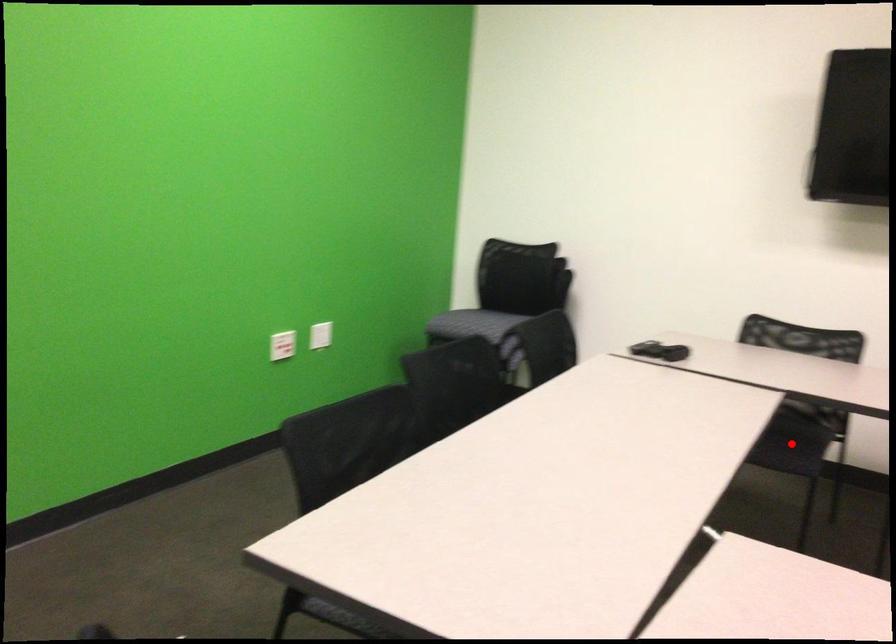
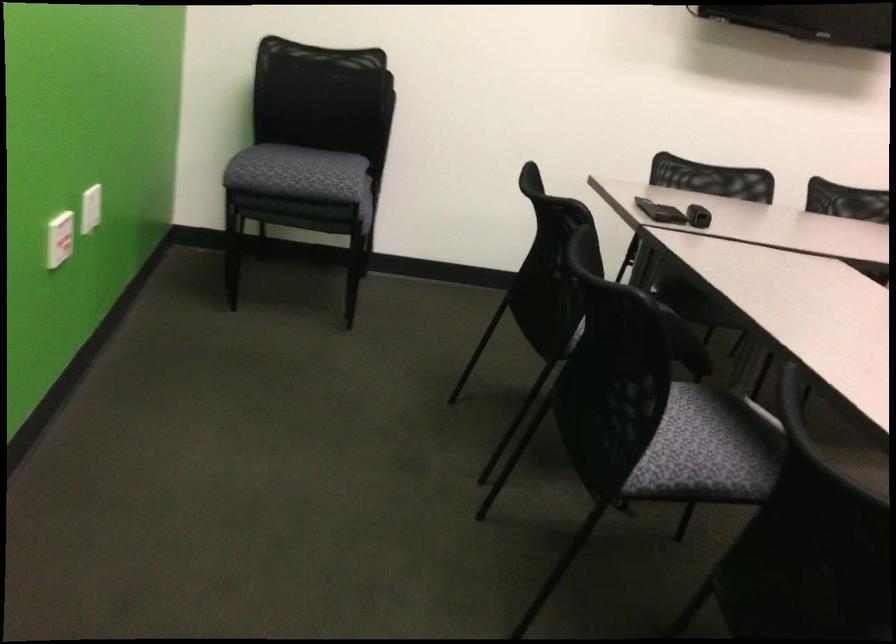
Question: I am providing you with two images of the same scene from different viewpoints. A red point is marked on the first image. Is the red point's position out of view in image 2?

Choices:
 (A) Yes
 (B) No

Answer: (A)